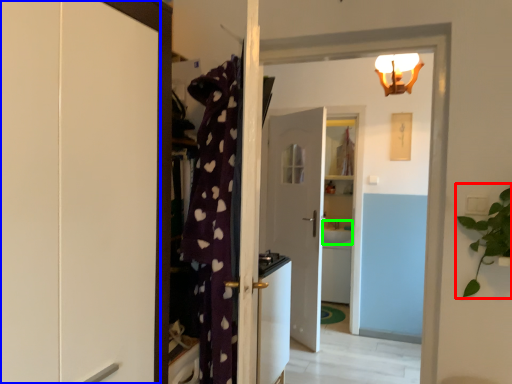
Question: Which is nearer to the houseplant (highlighted by a red box)? cabinetry (highlighted by a blue box) or sink (highlighted by a green box).

Choices:
 (A) cabinetry
 (B) sink

Answer: (A)